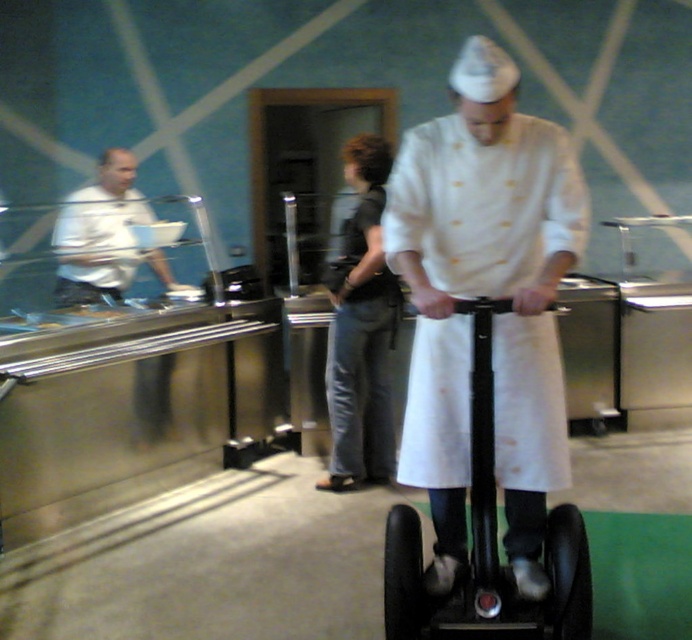
Is white matte chef coat at center wider than white matte shirt at left?

In fact, white matte chef coat at center might be narrower than white matte shirt at left.

Is white matte chef coat at center to the left of white matte shirt at left from the viewer's perspective?

In fact, white matte chef coat at center is to the right of white matte shirt at left.

Which is behind, point (502, 253) or point (145, 260)?

Point (145, 260)

The height and width of the screenshot is (640, 692). I want to click on white matte chef coat at center, so click(x=486, y=298).

Based on the photo, can you confirm if black rubber scooter at center is shorter than white matte shirt at left?

No.

Who is lower down, black rubber scooter at center or white matte shirt at left?

black rubber scooter at center is lower down.

At what (x,y) coordinates should I click in order to perform the action: click on black rubber scooter at center. Please return your answer as a coordinate pair (x, y). The width and height of the screenshot is (692, 640). Looking at the image, I should click on (486, 545).

How much distance is there between white matte chef coat at center and black rubber scooter at center?

white matte chef coat at center is 5.90 inches away from black rubber scooter at center.

Is white matte chef coat at center wider than black rubber scooter at center?

No.

Does point (536, 465) lie behind point (426, 592)?

Yes, point (536, 465) is farther from viewer.

Where is `white matte chef coat at center`? white matte chef coat at center is located at coordinates (486, 298).